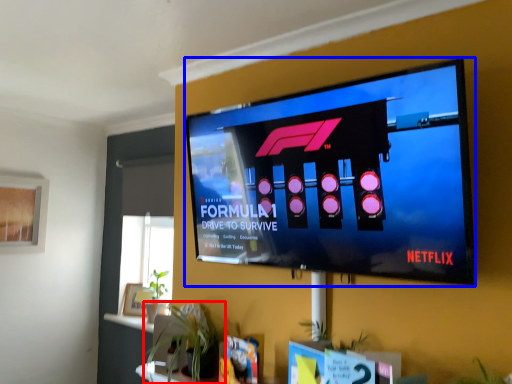
Question: Which object appears closest to the camera in this image, houseplant (highlighted by a red box) or television (highlighted by a blue box)?

Choices:
 (A) houseplant
 (B) television

Answer: (B)